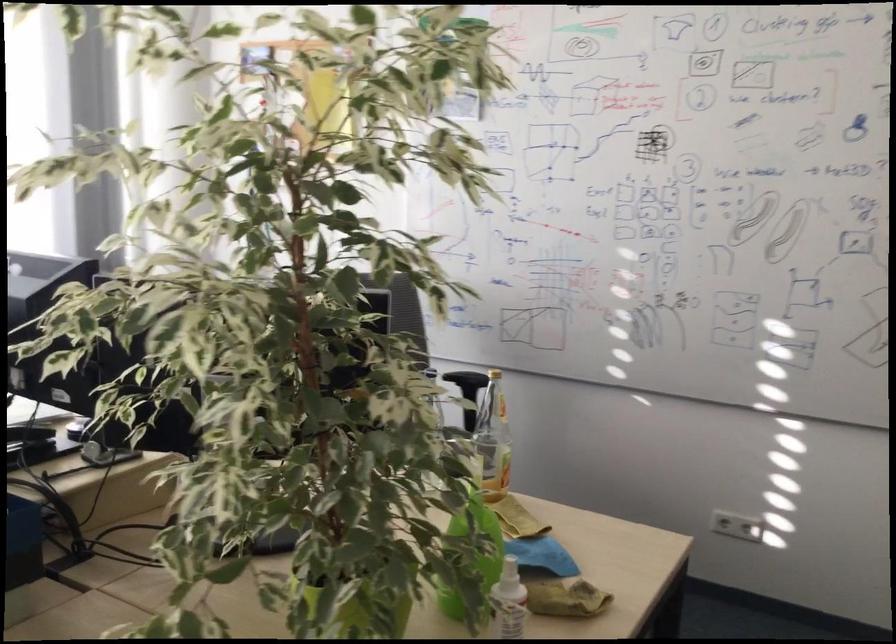
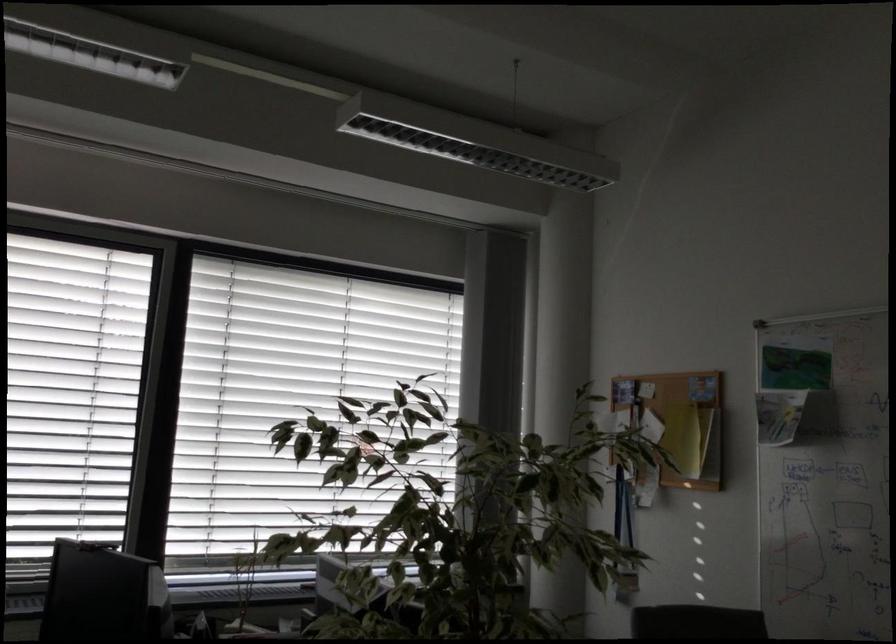
Based on the continuous images, in which direction is the camera rotating?

The camera rotated toward left-up.